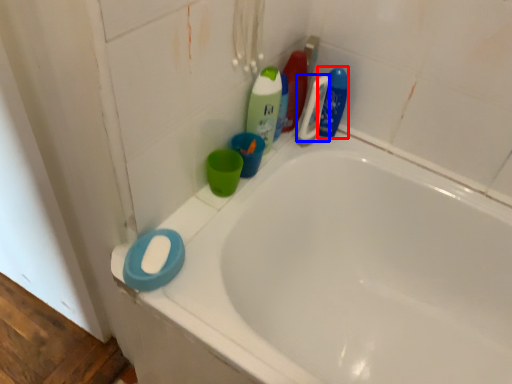
Question: Which object is closer to the camera taking this photo, cleaning product (highlighted by a red box) or cleaning product (highlighted by a blue box)?

Choices:
 (A) cleaning product
 (B) cleaning product

Answer: (B)